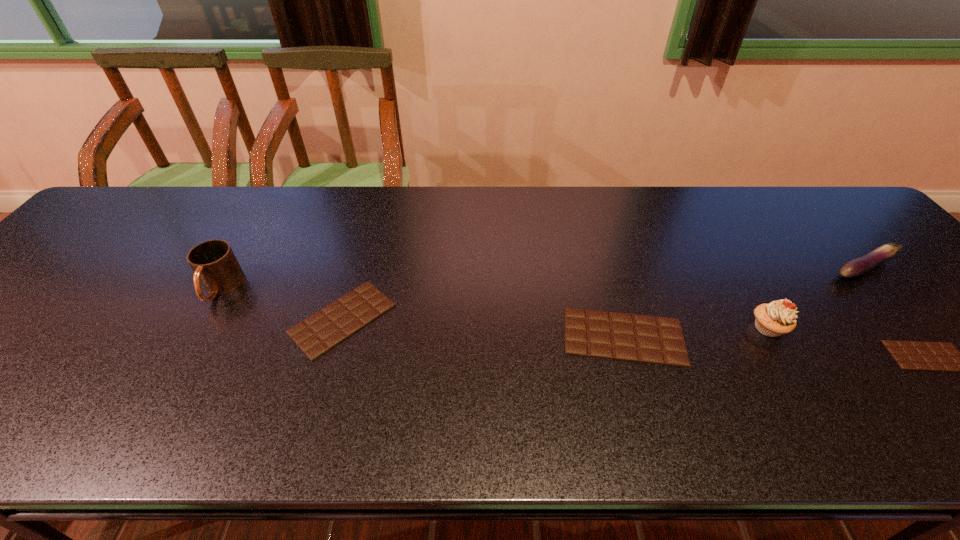
Identify which chocolate bar is located as the second nearest to the fourth object from left to right. Please provide its 2D coordinates. Your answer should be formatted as a tuple, i.e. [(x, y)], where the tuple contains the x and y coordinates of a point satisfying the conditions above.

[(910, 355)]

The image size is (960, 540). I want to click on chocolate bar that is the closest one to the mug, so click(317, 334).

The height and width of the screenshot is (540, 960). I want to click on free point that satisfies the following two spatial constraints: 1. on the back side of the eggplant; 2. on the left side of the second chocolate bar from left to right, so click(604, 268).

I want to click on free space that satisfies the following two spatial constraints: 1. on the side of the cupcake with the handle; 2. on the right side of the leftmost object, so click(197, 328).

Identify the location of free location that satisfies the following two spatial constraints: 1. on the side of the second chocolate bar from left to right with the handle; 2. on the right side of the mug. The width and height of the screenshot is (960, 540). (192, 337).